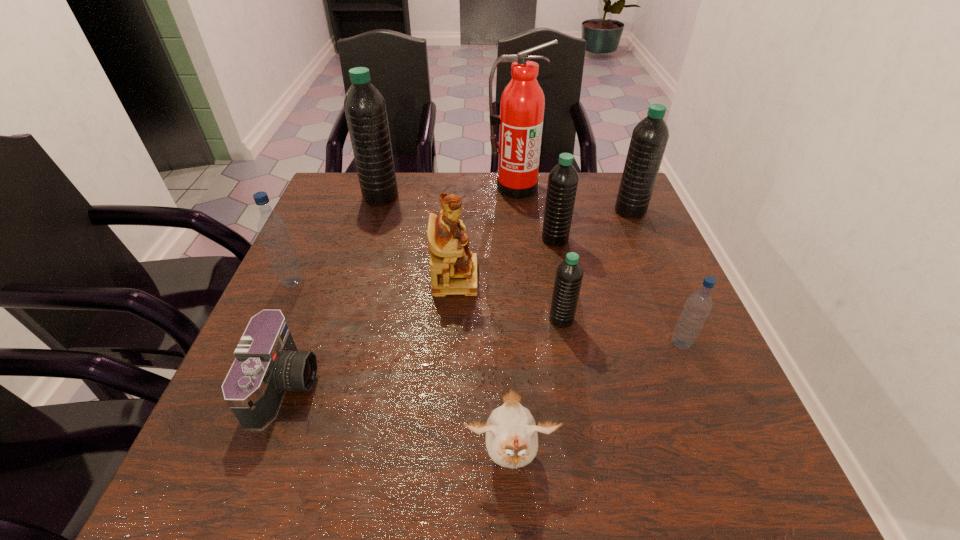
Find the location of a particular element. Image resolution: width=960 pixels, height=540 pixels. unoccupied area between the left blue water bottle and the ninth tallest object is located at coordinates (401, 369).

Where is `free space between the biggest black water bottle and the ninth tallest object`? The width and height of the screenshot is (960, 540). free space between the biggest black water bottle and the ninth tallest object is located at coordinates (445, 327).

The height and width of the screenshot is (540, 960). What are the coordinates of `unoccupied position between the biggest black water bottle and the rightmost black water bottle` in the screenshot? It's located at (505, 204).

The image size is (960, 540). I want to click on free space between the right blue water bottle and the black camera, so click(x=483, y=364).

Locate an element on the screen. This screenshot has height=540, width=960. blank region between the nearer blue water bottle and the ninth shortest object is located at coordinates (531, 270).

This screenshot has width=960, height=540. Identify the location of vacant point located between the seventh nearest object and the ninth tallest object. click(533, 348).

Where is `unoccupied area between the nearest black water bottle and the nearest water bottle`? unoccupied area between the nearest black water bottle and the nearest water bottle is located at coordinates (621, 332).

Locate an element on the screen. This screenshot has height=540, width=960. object that is the nearest to the shortest object is located at coordinates (272, 229).

Find the location of `object that is the fifth closest to the camera`. object that is the fifth closest to the camera is located at coordinates (365, 108).

Where is `water bottle object that ranks as the fourth closest to the left blue water bottle`? The height and width of the screenshot is (540, 960). water bottle object that ranks as the fourth closest to the left blue water bottle is located at coordinates (698, 305).